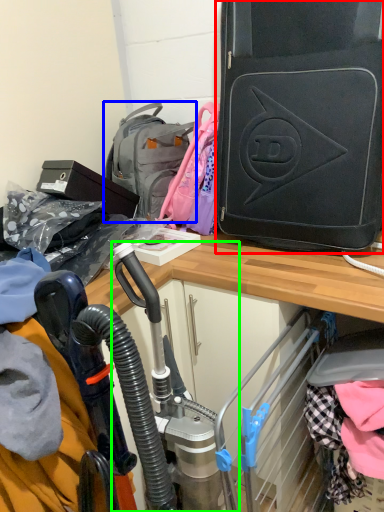
Question: Which object is the farthest from luggage and bags (highlighted by a red box)? Choose among these: backpack (highlighted by a blue box) or sport equipment (highlighted by a green box).

Choices:
 (A) backpack
 (B) sport equipment

Answer: (B)